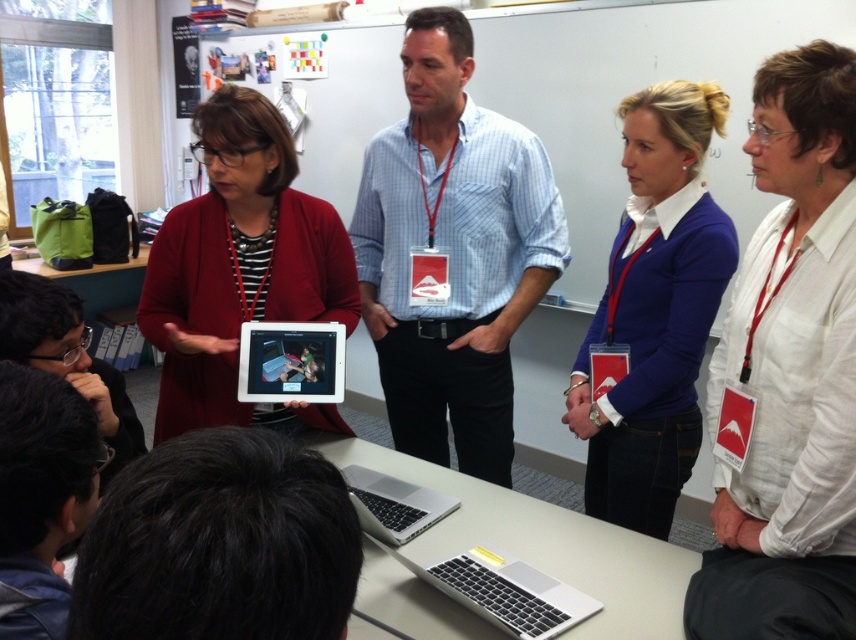
Does dark brown leather jacket at lower left lie behind black matte laptop at lower left?

No, it is in front of black matte laptop at lower left.

Can you confirm if dark brown leather jacket at lower left is wider than black matte laptop at lower left?

No.

Is point (22, 474) positioned behind point (135, 419)?

No.

The image size is (856, 640). I want to click on dark brown leather jacket at lower left, so click(x=40, y=496).

This screenshot has width=856, height=640. Find the location of `black matte laptop at lower left`. black matte laptop at lower left is located at coordinates (66, 356).

What do you see at coordinates (66, 356) in the screenshot? The image size is (856, 640). I see `black matte laptop at lower left` at bounding box center [66, 356].

Between point (16, 317) and point (403, 531), which one is positioned behind?

Positioned behind is point (403, 531).

Locate an element on the screen. black matte laptop at lower left is located at coordinates (66, 356).

Can you confirm if matte red cardigan at center is bigger than dark brown leather jacket at lower left?

Yes.

Is matte red cardigan at center to the right of dark brown leather jacket at lower left from the viewer's perspective?

Incorrect, matte red cardigan at center is not on the right side of dark brown leather jacket at lower left.

Is point (224, 228) positioned before point (36, 467)?

That is False.

I want to click on matte red cardigan at center, so click(x=241, y=269).